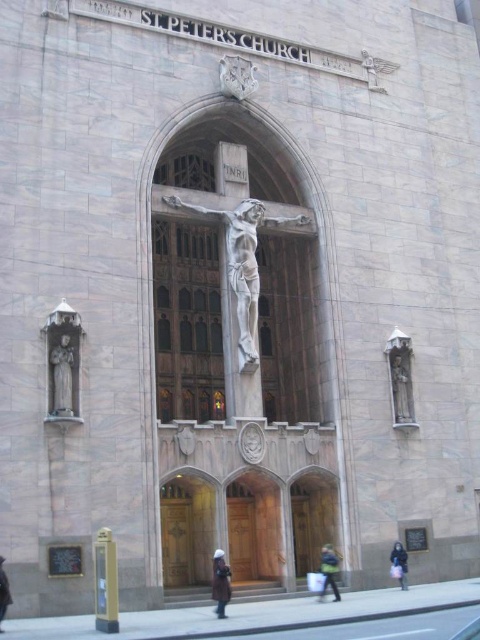
Is point (406, 552) closer to viewer compared to point (6, 611)?

No, it is not.

Does dark blue coat at lower right appear on the right side of dark gray coat at lower left?

Correct, you'll find dark blue coat at lower right to the right of dark gray coat at lower left.

Identify the location of dark blue coat at lower right. This screenshot has height=640, width=480. (399, 563).

The image size is (480, 640). I want to click on dark blue coat at lower right, so click(399, 563).

Can you confirm if white marble crucifix at center is taller than polished bronze crucifix at center?

Correct, white marble crucifix at center is much taller as polished bronze crucifix at center.

Where is `white marble crucifix at center`? This screenshot has height=640, width=480. white marble crucifix at center is located at coordinates pos(241,264).

Does point (253, 294) come behind point (250, 61)?

No, (253, 294) is in front of (250, 61).

This screenshot has width=480, height=640. I want to click on white marble crucifix at center, so click(x=241, y=264).

Measure the distance from brown wooden door at center to polished stone statue at right.

brown wooden door at center and polished stone statue at right are 26.68 feet apart from each other.

Does point (294, 499) come behind point (396, 410)?

Yes, it is.

Does point (331, 499) come farther from viewer compared to point (405, 412)?

No, it is not.

At what (x,y) coordinates should I click in order to perform the action: click on brown wooden door at center. Please return your answer as a coordinate pair (x, y). Image resolution: width=480 pixels, height=640 pixels. Looking at the image, I should click on (312, 518).